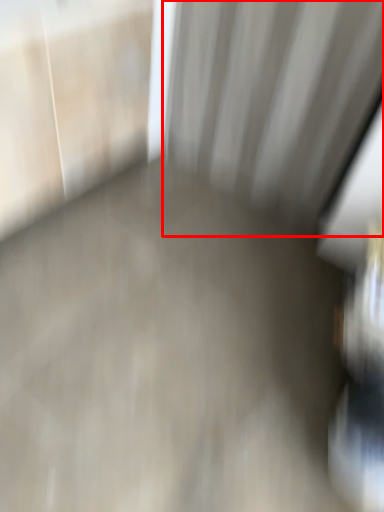
Question: Where is curtain (annotated by the red box) located in relation to concrete in the image?

Choices:
 (A) right
 (B) left

Answer: (A)